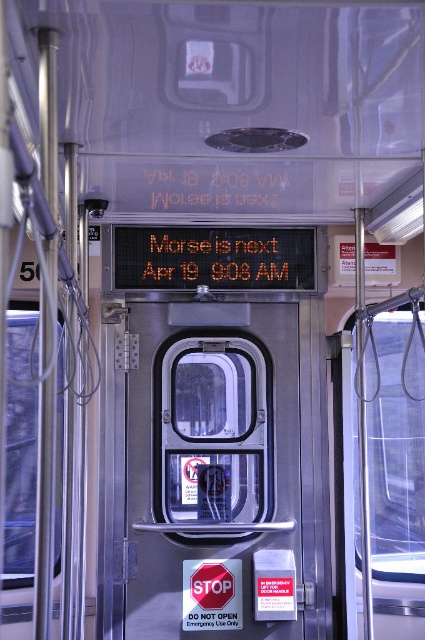
Image resolution: width=425 pixels, height=640 pixels. What do you see at coordinates (212, 472) in the screenshot? I see `transparent glass door at center` at bounding box center [212, 472].

Is transparent glass door at center above orange digital text at center?

No.

I want to click on transparent glass door at center, so click(x=212, y=472).

Find the location of a particular element. transparent glass door at center is located at coordinates (212, 472).

Who is more distant from viewer, (x=238, y=545) or (x=260, y=170)?

Positioned behind is point (x=238, y=545).

Is transparent glass door at center closer to camera compared to translucent plastic text at center?

No, it is behind translucent plastic text at center.

Which is in front, point (260, 449) or point (286, 193)?

Positioned in front is point (286, 193).

Where is `transparent glass door at center`? This screenshot has height=640, width=425. transparent glass door at center is located at coordinates (212, 472).

Does orange digital text at center have a greater height compared to translucent plastic text at center?

Yes.

Which is more to the right, orange digital text at center or translucent plastic text at center?

From the viewer's perspective, translucent plastic text at center appears more on the right side.

This screenshot has width=425, height=640. What are the coordinates of `orange digital text at center` in the screenshot? It's located at (215, 257).